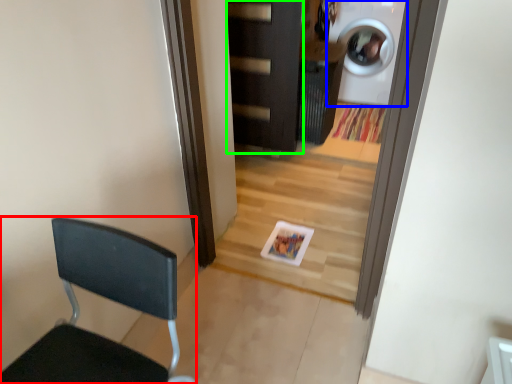
Question: Based on their relative distances, which object is farther from chair (highlighted by a red box)? Choose from washing machine (highlighted by a blue box) and door (highlighted by a green box).

Choices:
 (A) washing machine
 (B) door

Answer: (A)